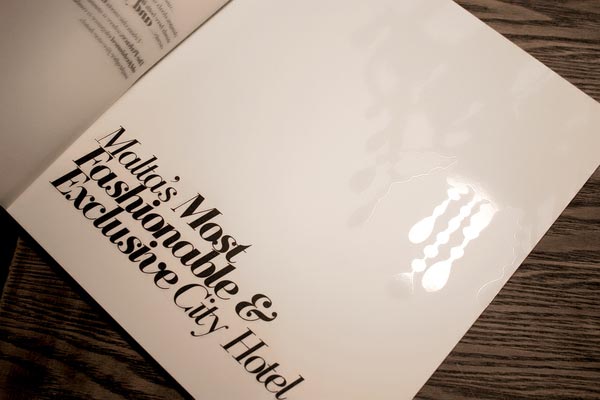
In order to click on book in this screenshot , I will do `click(512, 122)`.